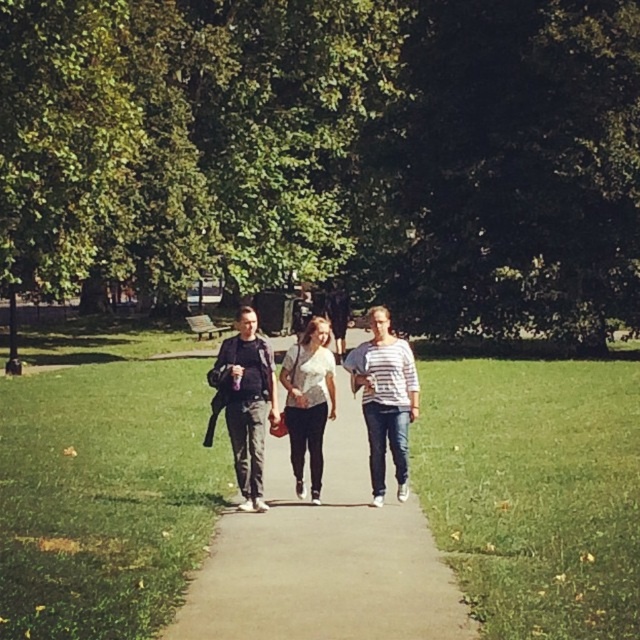
You are standing at the point with coordinates [324,557] in the park scene. What type of surface are you currently standing on?

You are standing on the smooth concrete path at center located at point [324,557].

You are standing at the point with coordinates (x=324, y=557) in the park. What type of surface are you currently standing on?

The point at coordinates (x=324, y=557) indicates a smooth concrete path at center, so you are standing on a smooth concrete path.

You are planning to walk on the smooth concrete path at center while wearing a white striped shirt at center. Will your shirt be visible against the path?

The smooth concrete path at center is larger in size than the white striped shirt at center, so the shirt will be visible against the path.